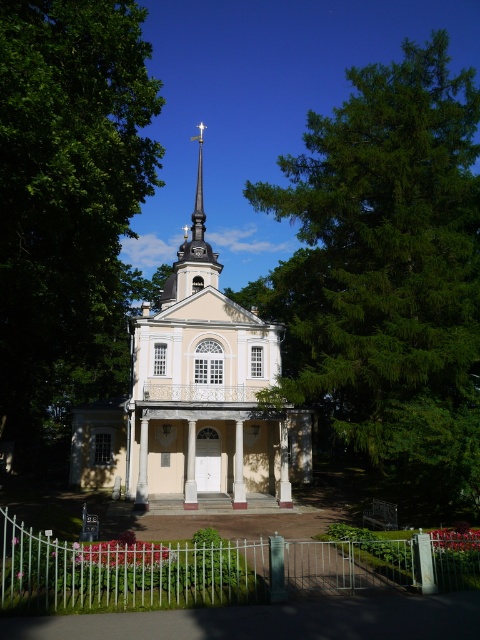
Is point (19, 608) in front of point (176, 296)?

Yes.

Based on the photo, which is above, green wrought iron gate at lower center or smooth silver spire at center?

smooth silver spire at center is above.

At what (x,y) coordinates should I click in order to perform the action: click on green wrought iron gate at lower center. Please return your answer as a coordinate pair (x, y). Looking at the image, I should click on (215, 570).

Is green leafy tree at upper right to the left of smooth silver spire at center from the viewer's perspective?

Incorrect, green leafy tree at upper right is not on the left side of smooth silver spire at center.

Between green leafy tree at upper right and smooth silver spire at center, which one appears on the right side from the viewer's perspective?

Positioned to the right is green leafy tree at upper right.

Which is behind, point (439, 48) or point (205, 253)?

Point (205, 253)

Locate an element on the screen. green leafy tree at upper right is located at coordinates (x=386, y=272).

Who is lower down, green leafy tree at center or white glossy church at center?

Positioned lower is green leafy tree at center.

Does green leafy tree at center lie in front of white glossy church at center?

That is True.

This screenshot has height=640, width=480. In order to click on green leafy tree at center in this screenshot , I will do `click(69, 200)`.